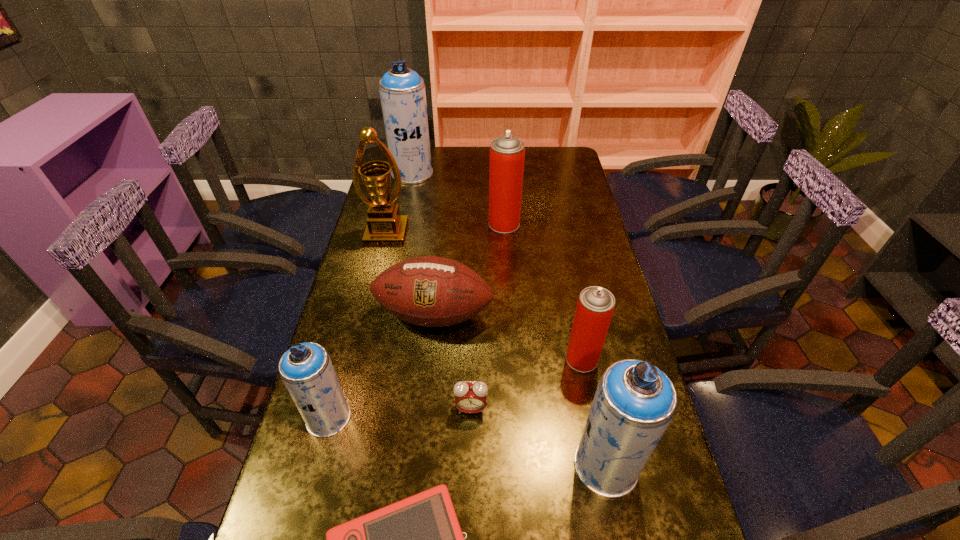
At what (x,y) coordinates should I click in order to perform the action: click on vacant space located on the clock face of the alarm clock. Please return your answer as a coordinate pair (x, y). Looking at the image, I should click on (470, 449).

Where is `object that is at the far edge`? object that is at the far edge is located at coordinates (402, 92).

Locate an element on the screen. The height and width of the screenshot is (540, 960). award situated at the left edge is located at coordinates (385, 227).

Locate an element on the screen. football (American) that is positioned at the left edge is located at coordinates (430, 291).

This screenshot has width=960, height=540. I want to click on object located in the far left corner section of the desktop, so click(x=402, y=92).

Find the location of a particular element. vacant space at the far edge of the desktop is located at coordinates (444, 158).

Where is `free location at the left edge of the desktop`? free location at the left edge of the desktop is located at coordinates click(x=295, y=472).

Image resolution: width=960 pixels, height=540 pixels. In the image, there is a desktop. What are the coordinates of `blank space at the right edge` in the screenshot? It's located at click(x=577, y=267).

This screenshot has height=540, width=960. In the image, there is a desktop. What are the coordinates of `vacant space at the far right corner` in the screenshot? It's located at (543, 148).

Locate an element on the screen. This screenshot has width=960, height=540. free area in between the third shortest object and the rightmost blue aerosol can is located at coordinates (520, 390).